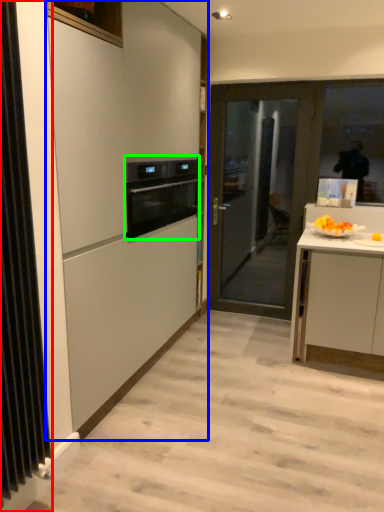
Question: Which is nearer to the radiator (highlighted by a red box)? cabinetry (highlighted by a blue box) or kitchen appliance (highlighted by a green box).

Choices:
 (A) cabinetry
 (B) kitchen appliance

Answer: (A)